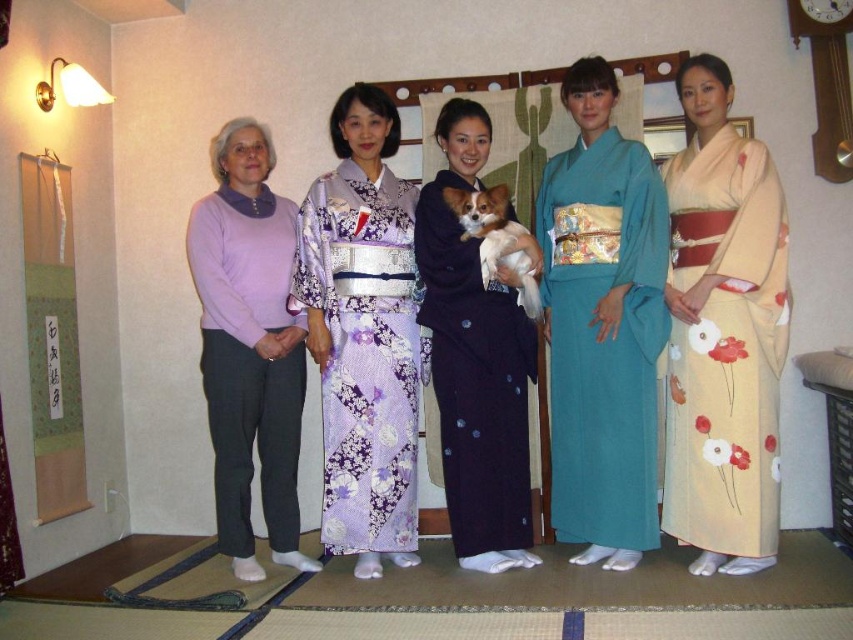
Can you confirm if dark blue kimono at center is positioned below white fur dog at center?

Yes.

Who is more forward, (466, 246) or (489, 240)?

Point (489, 240)

This screenshot has width=853, height=640. Identify the location of dark blue kimono at center. (474, 362).

Which is above, teal silk kimono at center or dark blue kimono at center?

Positioned higher is teal silk kimono at center.

Who is taller, teal silk kimono at center or dark blue kimono at center?

Standing taller between the two is teal silk kimono at center.

You are a GUI agent. You are given a task and a screenshot of the screen. Output one action in this format:
    pyautogui.click(x=<x>, y=<y>)
    Task: Click on the teal silk kimono at center
    The image size is (853, 640).
    Given the screenshot: What is the action you would take?
    pyautogui.click(x=602, y=324)

Is teal silk kimono at center above white fur dog at center?

No.

Who is higher up, teal silk kimono at center or white fur dog at center?

white fur dog at center is higher up.

This screenshot has height=640, width=853. What do you see at coordinates (602, 324) in the screenshot? I see `teal silk kimono at center` at bounding box center [602, 324].

You are a GUI agent. You are given a task and a screenshot of the screen. Output one action in this format:
    pyautogui.click(x=<x>, y=<y>)
    Task: Click on the teal silk kimono at center
    The image size is (853, 640).
    Given the screenshot: What is the action you would take?
    pyautogui.click(x=602, y=324)